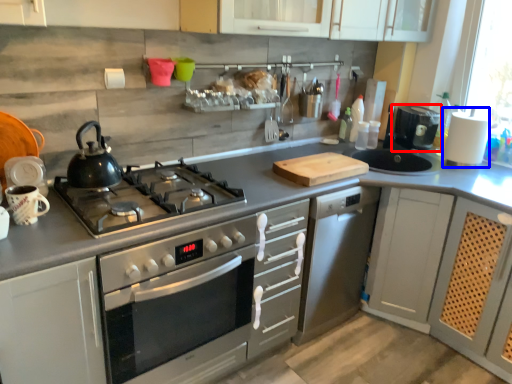
Question: Which object is closer to the camera taking this photo, coffee machine (highlighted by a red box) or appliance (highlighted by a blue box)?

Choices:
 (A) coffee machine
 (B) appliance

Answer: (B)